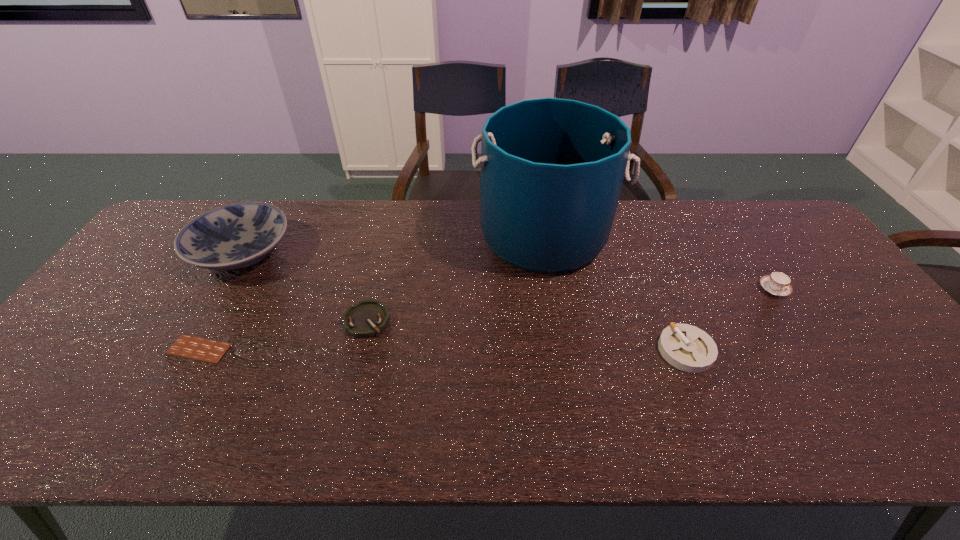
Identify the location of vacant point located between the fifth tallest object and the bucket. (456, 278).

Find the location of a particular element. This screenshot has height=540, width=960. free space that is in between the chocolate bar and the tallest object is located at coordinates (372, 292).

At what (x,y) coordinates should I click in order to perform the action: click on free area in between the third object from left to right and the fourth object from left to right. Please return your answer as a coordinate pair (x, y). Looking at the image, I should click on (456, 278).

Where is `vacant space that's between the bucket and the shortest object`? The image size is (960, 540). vacant space that's between the bucket and the shortest object is located at coordinates (372, 292).

Image resolution: width=960 pixels, height=540 pixels. I want to click on free space between the fourth shortest object and the shortest object, so click(487, 319).

The image size is (960, 540). In order to click on the closest object to the teacup in this screenshot , I will do `click(688, 348)`.

Locate which object is the fifth closest to the second object from right to left. Please provide its 2D coordinates. Your answer should be formatted as a tuple, i.e. [(x, y)], where the tuple contains the x and y coordinates of a point satisfying the conditions above.

[(207, 350)]

Identify the location of vacant point that satisfies the following two spatial constraints: 1. on the front side of the second object from right to left; 2. on the left side of the plate. (182, 350).